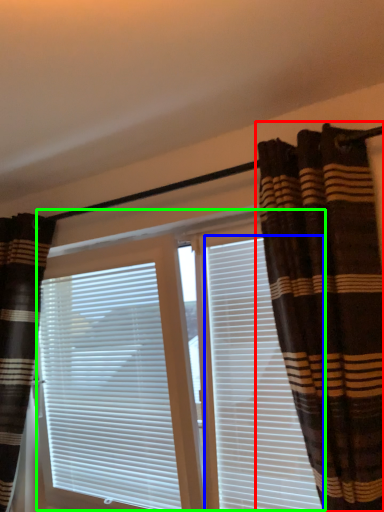
Question: Estimate the real-world distances between objects in this image. Which object is farther from curtain (highlighted by a red box), shutter (highlighted by a blue box) or bay window (highlighted by a green box)?

Choices:
 (A) shutter
 (B) bay window

Answer: (B)